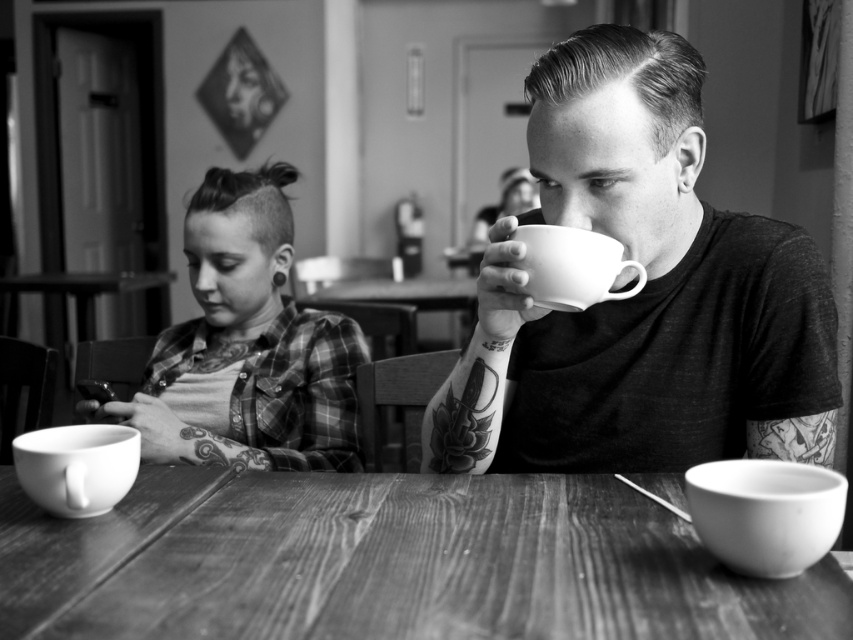
Question: Where is plaid shirt at left located in relation to white ceramic mug at lower right in the image?

Choices:
 (A) left
 (B) right

Answer: (A)

Question: Which of the following is the closest to the observer?

Choices:
 (A) matte ceramic cup at center
 (B) white ceramic mug at lower left
 (C) plaid shirt at left

Answer: (B)

Question: Where is plaid shirt at left located in relation to white ceramic mug at lower left in the image?

Choices:
 (A) above
 (B) below

Answer: (A)

Question: Is wooden table at center smaller than white ceramic mug at upper center?

Choices:
 (A) no
 (B) yes

Answer: (A)

Question: Which object is the closest to the white ceramic mug at lower right?

Choices:
 (A) matte ceramic cup at center
 (B) white ceramic mug at upper center

Answer: (B)

Question: Which of these objects is positioned closest to the white ceramic mug at lower left?

Choices:
 (A) white ceramic mug at lower right
 (B) matte ceramic cup at center

Answer: (B)